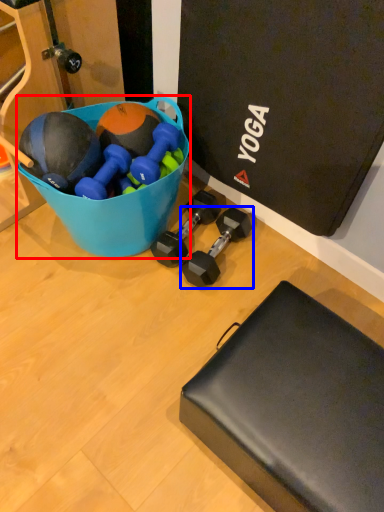
Question: Which object appears farthest to the camera in this image, bowl (highlighted by a red box) or dumbbell (highlighted by a blue box)?

Choices:
 (A) bowl
 (B) dumbbell

Answer: (B)